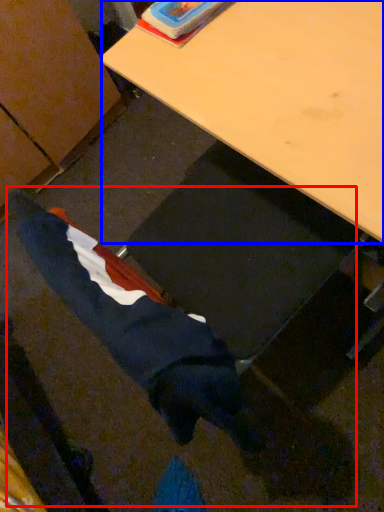
Question: Which object appears farthest to the camera in this image, woman (highlighted by a red box) or desk (highlighted by a blue box)?

Choices:
 (A) woman
 (B) desk

Answer: (B)